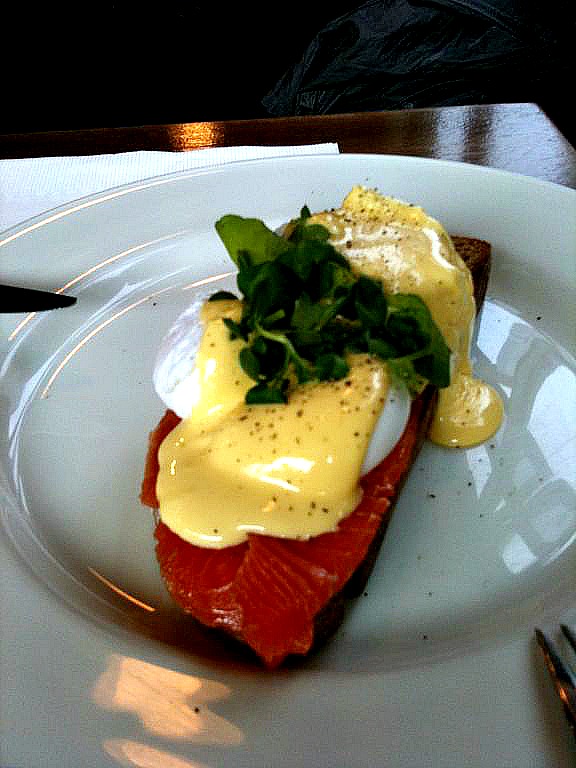
Find the location of a particular element. table is located at coordinates (492, 108).